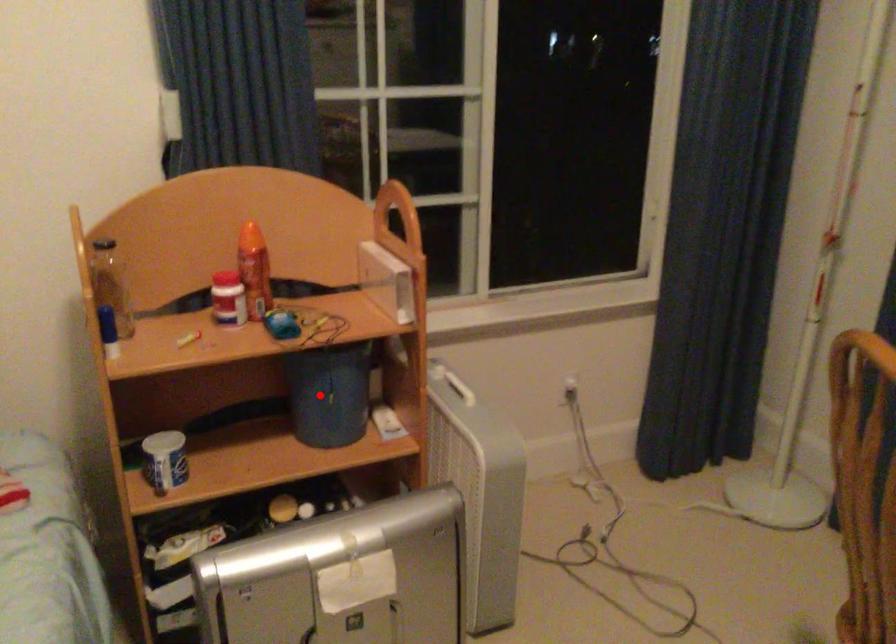
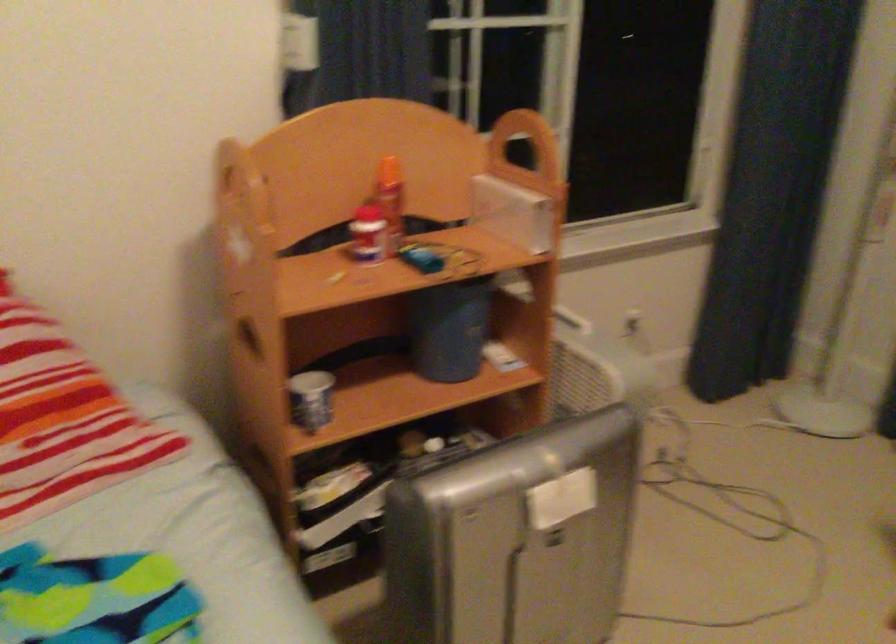
The point at the highlighted location is marked in the first image. Where is the corresponding point in the second image?

(449, 328)